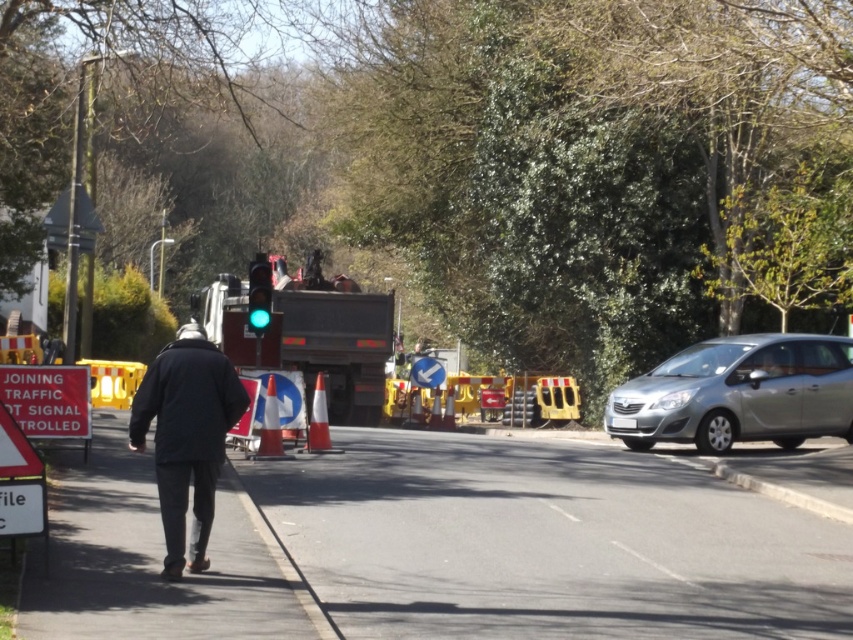
You are a delivery robot navigating a street scene. You need to move from your current position to a delivery point located at point (16,394). There is an obstacle at point (437,376). Can you safely reach the delivery point without passing through the obstacle?

Yes, you can safely reach the delivery point at point (16,394) because it is in front of the obstacle at point (437,376), meaning the obstacle is behind the delivery point and not in your path.

You are a pedestrian standing at the edge of the sidewalk. You see the dark blue jacket at center and the red plastic sign at left. Which object is closer to you?

The dark blue jacket at center is closer to you because it is positioned under the red plastic sign at left, meaning it is in front of the sign from your perspective.